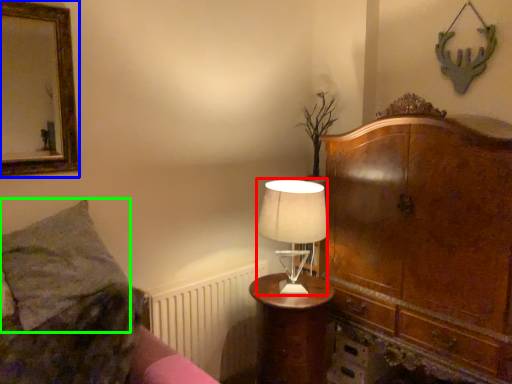
Question: Which object is the farthest from table lamp (highlighted by a red box)? Choose among these: picture frame (highlighted by a blue box) or pillow (highlighted by a green box).

Choices:
 (A) picture frame
 (B) pillow

Answer: (A)